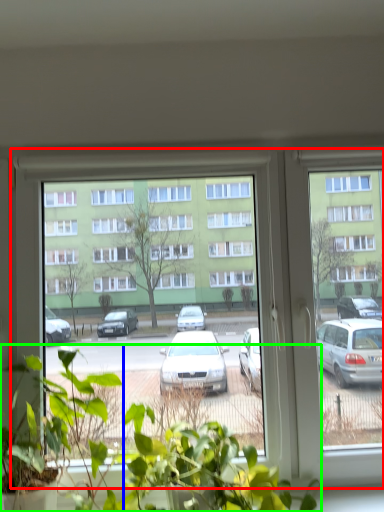
Question: Estimate the real-world distances between objects in this image. Which object is farther from window (highlighted by a red box), houseplant (highlighted by a blue box) or houseplant (highlighted by a green box)?

Choices:
 (A) houseplant
 (B) houseplant

Answer: (A)